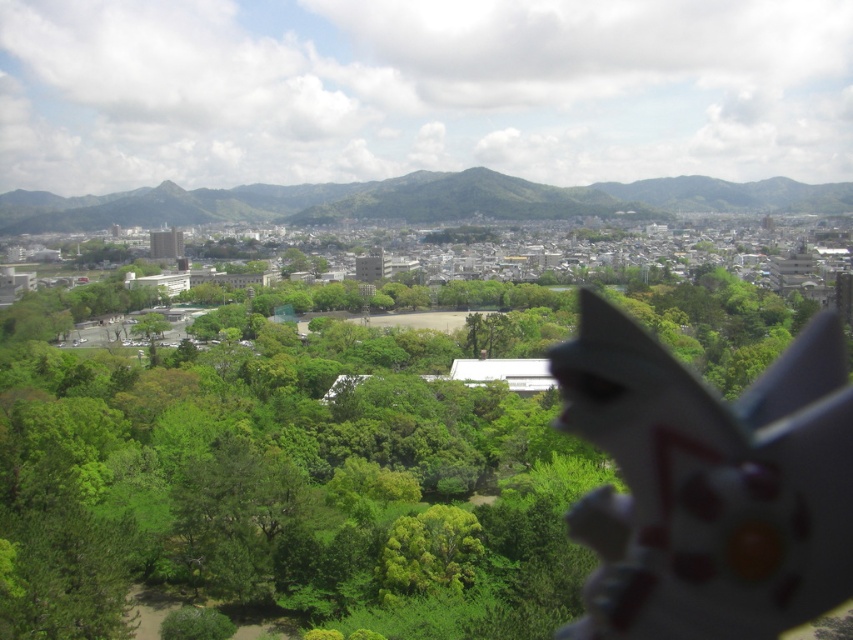
You are an urban planner analyzing the cityscape. You see the green leafy tree at center and the green textured mountain at upper center. Which object is taller in the scene?

The green leafy tree at center is taller than the green textured mountain at upper center.